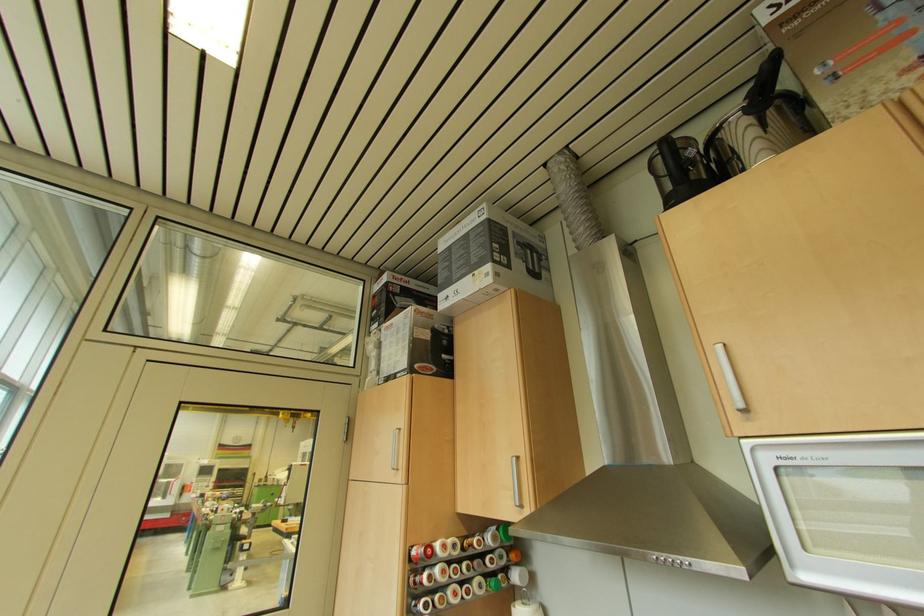
Find where to lift the black pot handle. Please return your answer as a coordinate pair (x, y).

(670, 166)